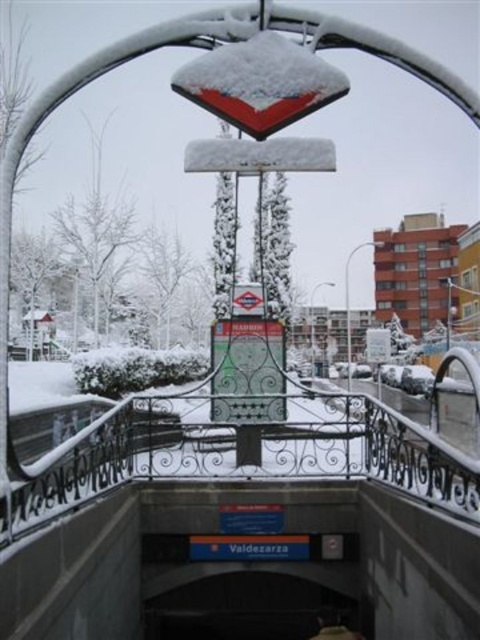
Question: Which point is farther from the camera taking this photo?

Choices:
 (A) (371, 241)
 (B) (331, 282)

Answer: (A)

Question: Does metallic silver streetlamp at center come behind metallic lamp post at center?

Choices:
 (A) yes
 (B) no

Answer: (B)

Question: Which point is farther from the camera taking this photo?

Choices:
 (A) (311, 307)
 (B) (360, 243)

Answer: (A)

Question: Does metallic silver streetlamp at center have a larger size compared to metallic lamp post at center?

Choices:
 (A) yes
 (B) no

Answer: (A)

Question: In this image, where is metallic silver streetlamp at center located relative to metallic lamp post at center?

Choices:
 (A) above
 (B) below

Answer: (A)